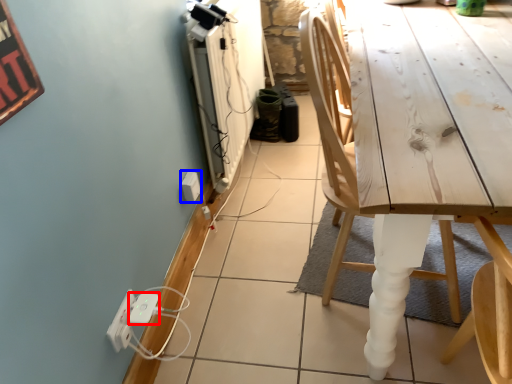
Question: Which of the following is the farthest to the observer, extension cord (highlighted by a red box) or electric outlet (highlighted by a blue box)?

Choices:
 (A) extension cord
 (B) electric outlet

Answer: (B)